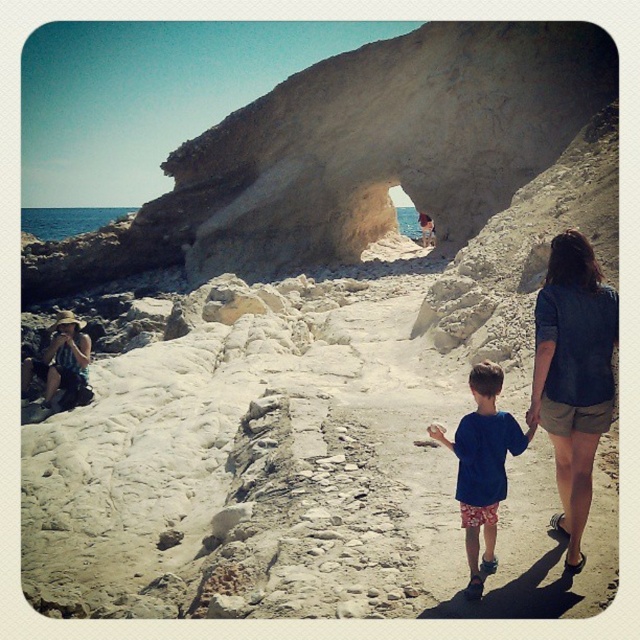
You are a hiker planning to walk from the starting point to the ocean view through the beige stone arch at center. You notice the denim shorts at right nearby. Which object is closer to your current position?

The beige stone arch at center is closer to you than the denim shorts at right because it is further to the viewer than the denim shorts at right.

You are standing at the point closer to the viewer between the two points, point (211, 275) and point (499, 499). Which point are you standing at?

You are standing at point (211, 275) because it is closer to the viewer compared to point (499, 499).

You are a photographer trying to capture the denim shorts at right and the blue cotton shirt at center in the same frame. Based on their positions, which one appears closer to the camera?

The denim shorts at right is positioned over the blue cotton shirt at center, so it appears closer to the camera.